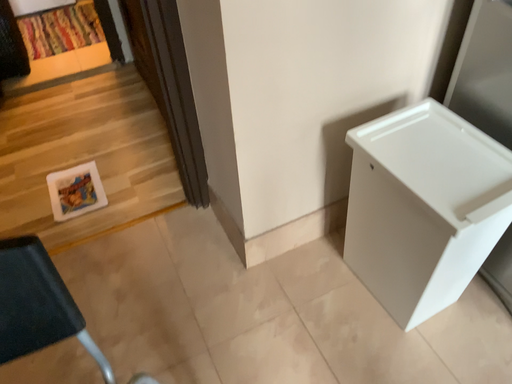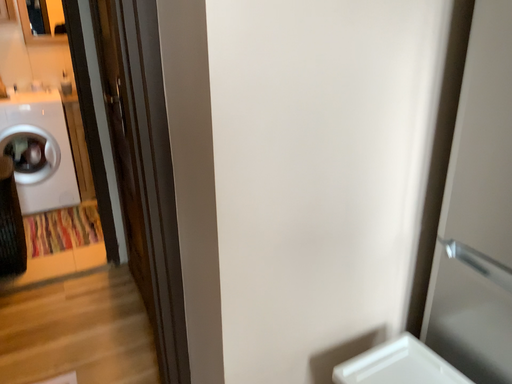
Question: Which way did the camera rotate in the video?

Choices:
 (A) rotated downward
 (B) rotated upward

Answer: (B)